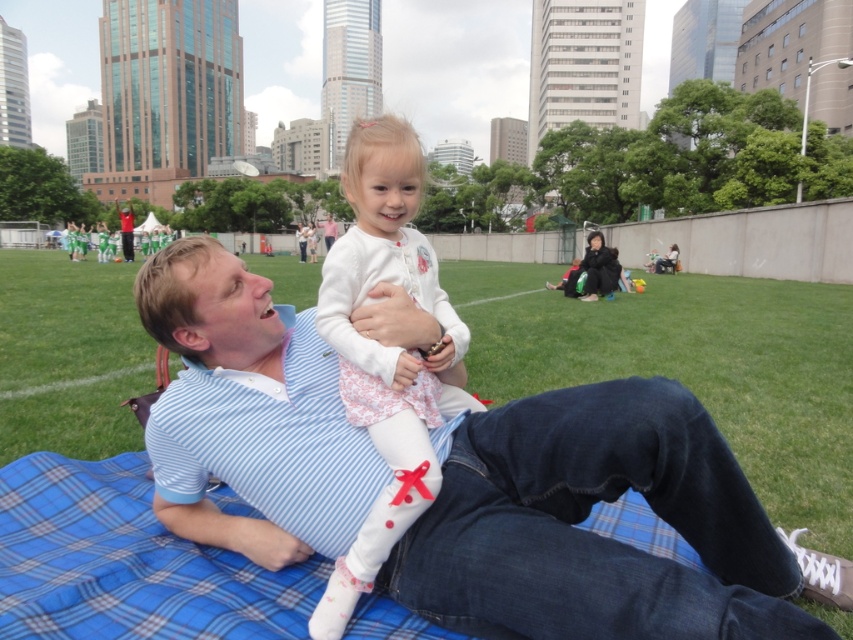
Question: Is blue striped shirt at center wider than white soft fabric at center?

Choices:
 (A) no
 (B) yes

Answer: (B)

Question: Which point is closer to the camera?

Choices:
 (A) (456, 348)
 (B) (277, 419)

Answer: (B)

Question: Can you confirm if blue striped shirt at center is positioned below white soft fabric at center?

Choices:
 (A) yes
 (B) no

Answer: (A)

Question: Does blue striped shirt at center appear over white soft fabric at center?

Choices:
 (A) no
 (B) yes

Answer: (A)